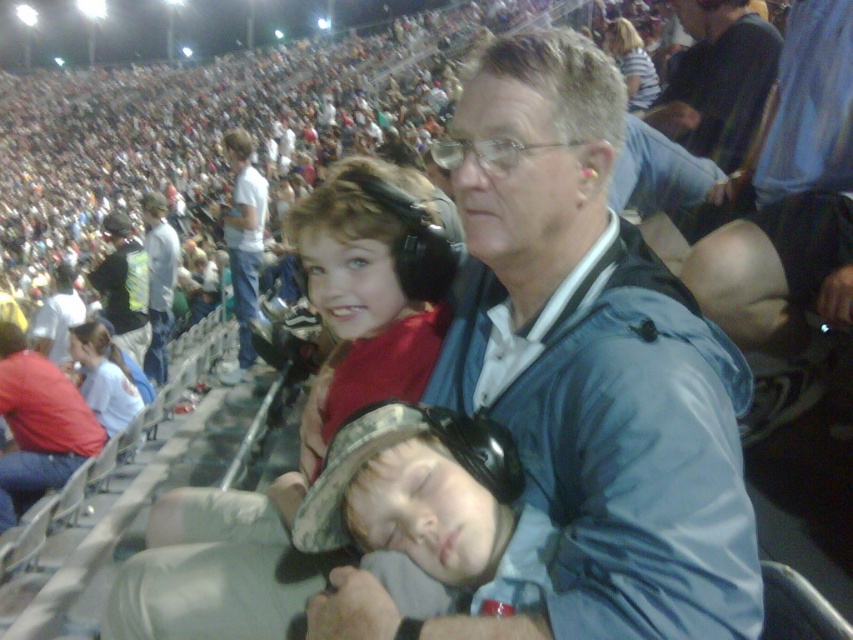
Question: From the image, what is the correct spatial relationship of dark blue shirt at upper right in relation to striped shirt at upper center?

Choices:
 (A) above
 (B) below

Answer: (B)

Question: Which point is closer to the camera taking this photo?

Choices:
 (A) (4, 486)
 (B) (744, 10)
 (C) (648, 74)
 (D) (358, 308)

Answer: (D)

Question: Among these points, which one is farthest from the camera?

Choices:
 (A) (160, 353)
 (B) (119, 292)

Answer: (A)

Question: Is blue fabric jacket at center to the right of matte red shirt at center from the viewer's perspective?

Choices:
 (A) no
 (B) yes

Answer: (B)

Question: Does red shirt at left appear over striped shirt at upper center?

Choices:
 (A) yes
 (B) no

Answer: (B)

Question: Among these objects, which one is farthest from the camera?

Choices:
 (A) blue fabric jacket at center
 (B) reflective silver helmet at upper center
 (C) striped shirt at upper center
 (D) white cotton shirt at upper left

Answer: (B)